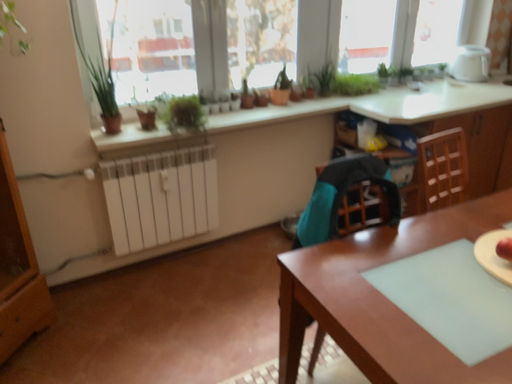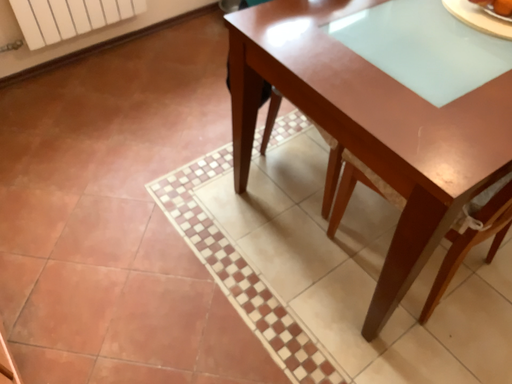
Question: How did the camera likely rotate when shooting the video?

Choices:
 (A) rotated right
 (B) rotated left

Answer: (A)